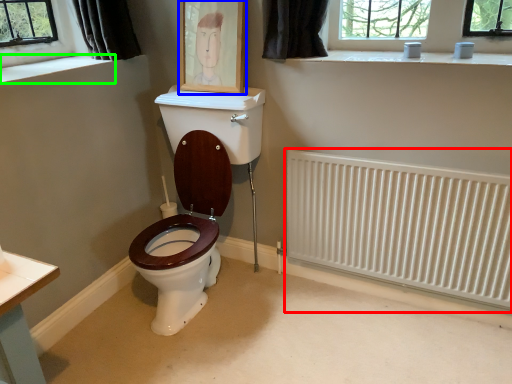
Question: Based on their relative distances, which object is nearer to radiator (highlighted by a red box)? Choose from picture frame (highlighted by a blue box) and window sill (highlighted by a green box).

Choices:
 (A) picture frame
 (B) window sill

Answer: (A)